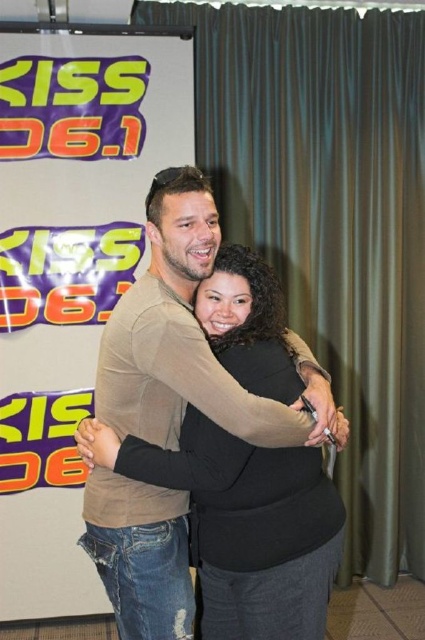
Question: Which point is farther to the camera?

Choices:
 (A) (119, 378)
 (B) (399, 97)
 (C) (99, 276)

Answer: (B)

Question: Which object is the farthest from the matte brown shirt at center?

Choices:
 (A) matte white banner at upper left
 (B) matte green curtain at center

Answer: (B)

Question: Can you confirm if matte green curtain at center is wider than matte white banner at upper left?

Choices:
 (A) yes
 (B) no

Answer: (A)

Question: Can you confirm if matte green curtain at center is positioned above matte white banner at upper left?

Choices:
 (A) no
 (B) yes

Answer: (B)

Question: Which is nearer to the matte green curtain at center?

Choices:
 (A) matte brown shirt at center
 (B) matte white banner at upper left

Answer: (B)

Question: Does matte green curtain at center appear on the left side of matte white banner at upper left?

Choices:
 (A) yes
 (B) no

Answer: (B)